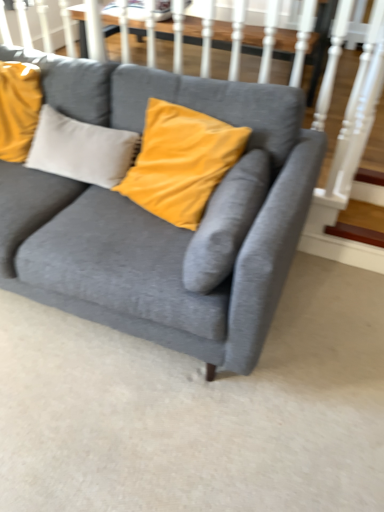
Question: From the image's perspective, is velvet gray couch at center over wooden stairs at lower right?

Choices:
 (A) no
 (B) yes

Answer: (B)

Question: Considering the relative positions of velvet gray couch at center and wooden stairs at lower right in the image provided, is velvet gray couch at center in front of wooden stairs at lower right?

Choices:
 (A) yes
 (B) no

Answer: (A)

Question: Can you confirm if velvet gray couch at center is positioned to the left of wooden stairs at lower right?

Choices:
 (A) no
 (B) yes

Answer: (B)

Question: From a real-world perspective, is velvet gray couch at center below wooden stairs at lower right?

Choices:
 (A) no
 (B) yes

Answer: (A)

Question: Considering the relative sizes of velvet gray couch at center and wooden stairs at lower right in the image provided, is velvet gray couch at center smaller than wooden stairs at lower right?

Choices:
 (A) no
 (B) yes

Answer: (A)

Question: Is velvet gray couch at center wider than wooden stairs at lower right?

Choices:
 (A) yes
 (B) no

Answer: (A)

Question: Is velvet gray couch at center completely or partially inside wooden stairs at lower right?

Choices:
 (A) no
 (B) yes

Answer: (A)

Question: From the image's perspective, is wooden stairs at lower right over velvet gray couch at center?

Choices:
 (A) yes
 (B) no

Answer: (B)

Question: Is wooden stairs at lower right at the left side of velvet gray couch at center?

Choices:
 (A) no
 (B) yes

Answer: (A)

Question: Is wooden stairs at lower right at the right side of velvet gray couch at center?

Choices:
 (A) yes
 (B) no

Answer: (A)

Question: Considering the relative sizes of wooden stairs at lower right and velvet gray couch at center in the image provided, is wooden stairs at lower right smaller than velvet gray couch at center?

Choices:
 (A) yes
 (B) no

Answer: (A)

Question: Considering the relative sizes of wooden stairs at lower right and velvet gray couch at center in the image provided, is wooden stairs at lower right thinner than velvet gray couch at center?

Choices:
 (A) yes
 (B) no

Answer: (A)

Question: Is wooden stairs at lower right spatially inside velvet gray couch at center, or outside of it?

Choices:
 (A) inside
 (B) outside

Answer: (B)